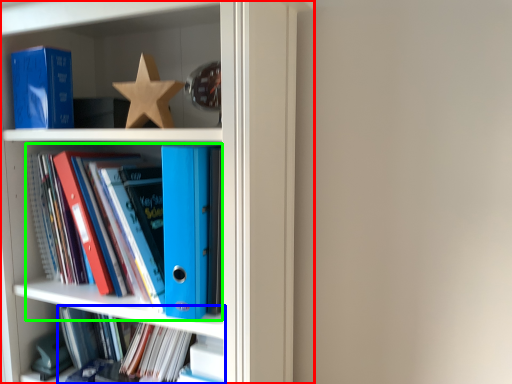
Question: Which object is the farthest from bookcase (highlighted by a red box)? Choose among these: book (highlighted by a blue box) or book (highlighted by a green box).

Choices:
 (A) book
 (B) book

Answer: (A)